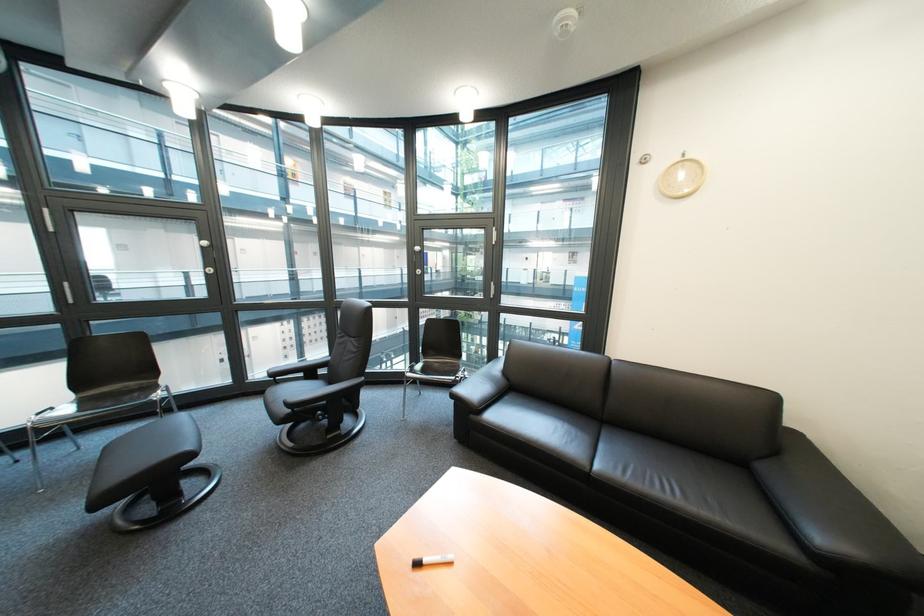
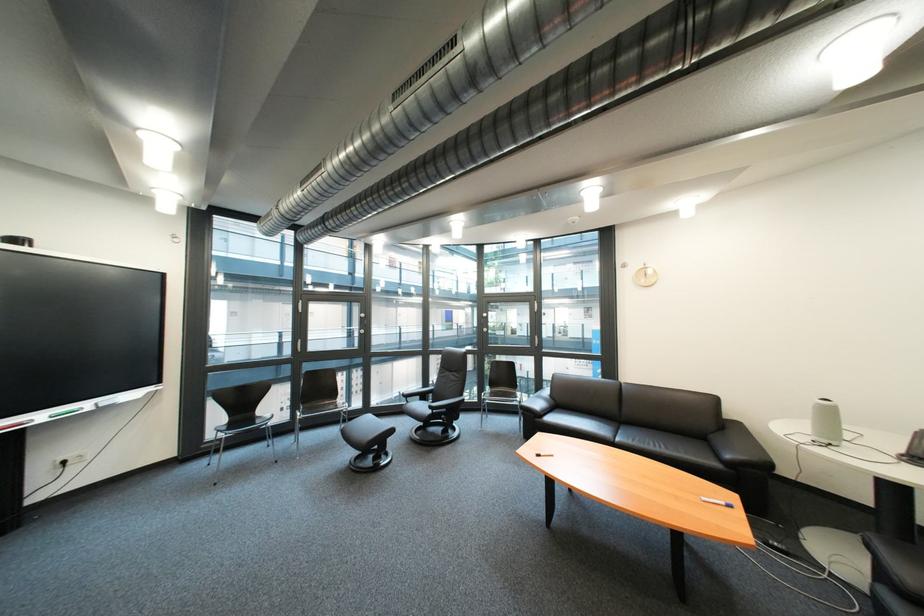
Find the pixel in the second image that matches [306,273] in the first image.

(363, 331)